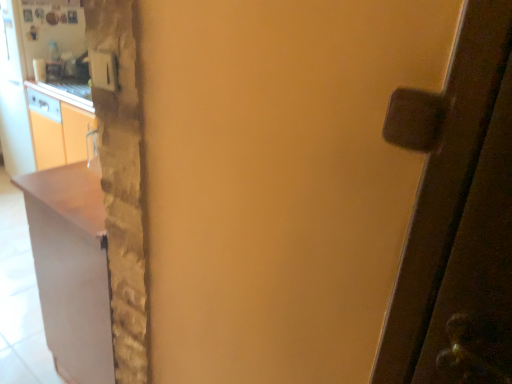
Question: Should I look upward or downward to see matte white cabinet at left?

Choices:
 (A) down
 (B) up

Answer: (A)